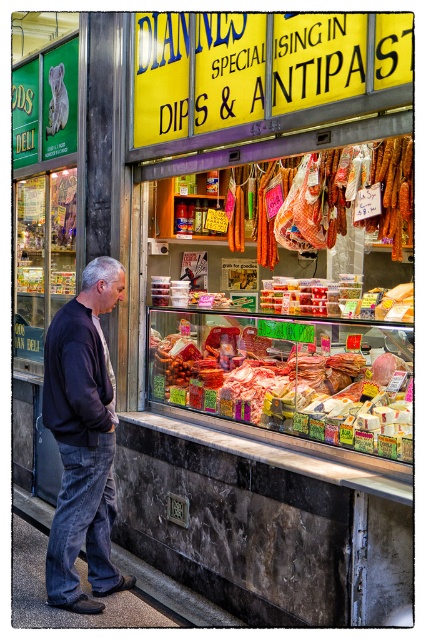
You are a customer standing at the entrance of the deli. You want to grab the meaty red at center and dark blue jeans at lower left. Which item is closer to your current position?

The dark blue jeans at lower left is closer to your current position because it is only 3.91 feet away from the meaty red at center, which is further away.

You are standing in front of the deli and want to locate the meaty red at center. Where exactly is it positioned relative to the deli sign?

The meaty red at center is located at point 0.598 on the x axis and 0.667 on the y axis relative to the deli sign.

You are a customer standing in front of the deli counter. You see the meaty red at center and the transparent glass display case at center. Which item is closer to you?

The meaty red at center is closer to you than the transparent glass display case at center.